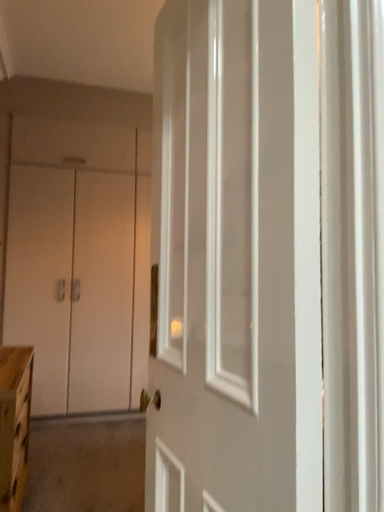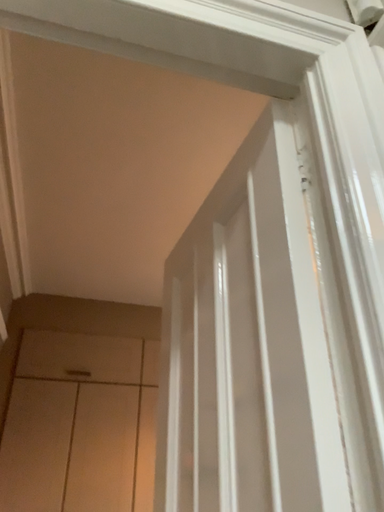
Question: Which way did the camera rotate in the video?

Choices:
 (A) rotated downward
 (B) rotated upward

Answer: (B)